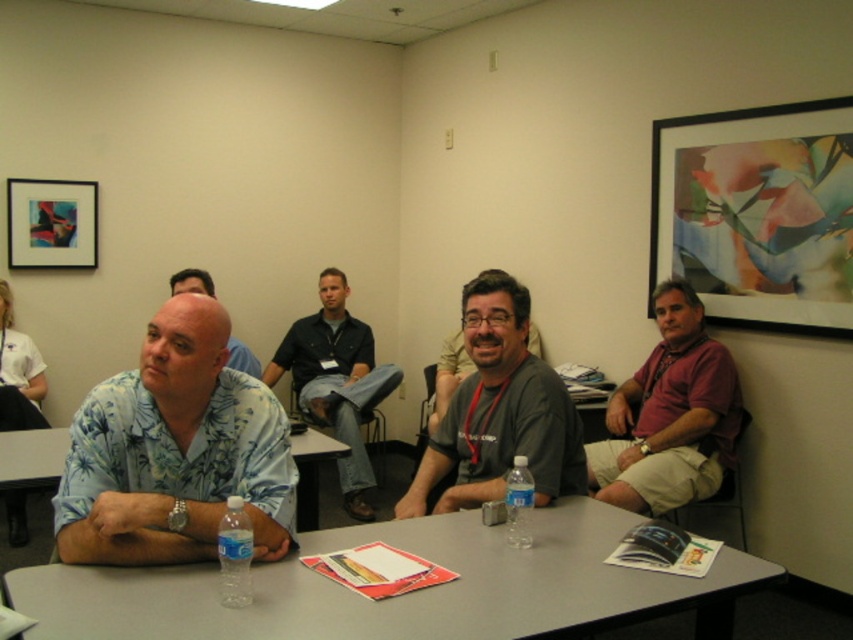
Question: Does blue floral shirt at left appear over blue floral shirt at center?

Choices:
 (A) yes
 (B) no

Answer: (B)

Question: Which point is farther to the camera?

Choices:
 (A) blue floral shirt at center
 (B) gray fabric shirt at center

Answer: (A)

Question: Which is nearer to the matte plastic picture frame at upper left?

Choices:
 (A) blue floral shirt at center
 (B) dark blue shirt at center

Answer: (A)

Question: Which point is farther from the camera taking this photo?

Choices:
 (A) (311, 362)
 (B) (47, 230)

Answer: (A)

Question: Does gray fabric shirt at center have a larger size compared to matte plastic table at center?

Choices:
 (A) no
 (B) yes

Answer: (B)

Question: Can you confirm if gray plastic table at center is positioned to the right of gray fabric shirt at center?

Choices:
 (A) no
 (B) yes

Answer: (A)